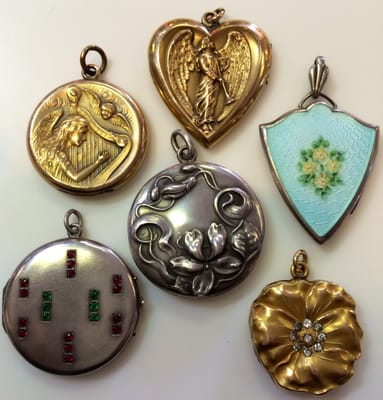
Locate an element on the screen. pendants is located at coordinates (67, 317), (312, 339), (200, 262), (307, 187), (203, 92), (83, 138).